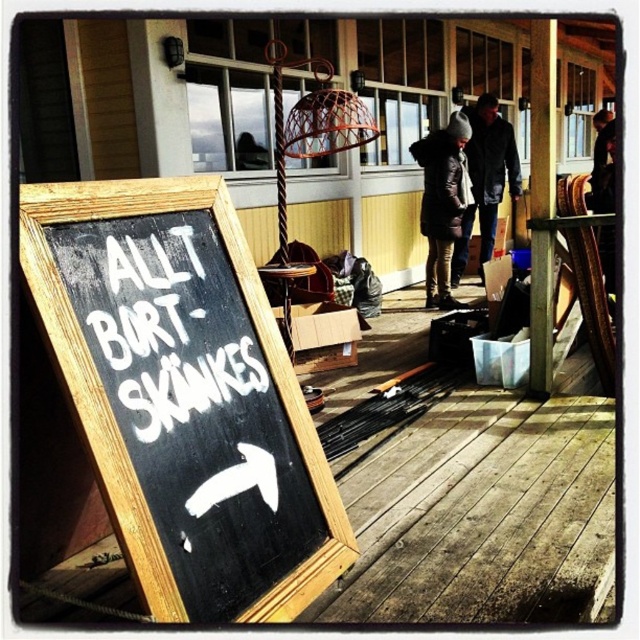
Which is more to the right, black chalkboard at left or white chalkboard sign at left?

black chalkboard at left is more to the right.

Between black chalkboard at left and white chalkboard sign at left, which one has more height?

black chalkboard at left

Who is more forward, [152,244] or [228,371]?

Point [152,244] is more forward.

Locate an element on the screen. black chalkboard at left is located at coordinates 184,396.

Is black chalkboard at left positioned at the back of dark gray woolen hat at center?

That is False.

Can you confirm if black chalkboard at left is smaller than dark gray woolen hat at center?

Correct, black chalkboard at left occupies less space than dark gray woolen hat at center.

Who is more distant from viewer, (76, 378) or (477, 259)?

Point (477, 259)

Where is `black chalkboard at left`? black chalkboard at left is located at coordinates (184, 396).

Who is more forward, (161, 292) or (458, 220)?

Point (161, 292) is in front.

Can you confirm if white chalkboard sign at left is positioned below dark brown fur coat at center?

Indeed, white chalkboard sign at left is positioned under dark brown fur coat at center.

What are the coordinates of `white chalkboard sign at left` in the screenshot? It's located at (173, 328).

You are a GUI agent. You are given a task and a screenshot of the screen. Output one action in this format:
    pyautogui.click(x=<x>, y=<y>)
    Task: Click on the white chalkboard sign at left
    The height and width of the screenshot is (640, 640).
    Given the screenshot: What is the action you would take?
    pyautogui.click(x=173, y=328)